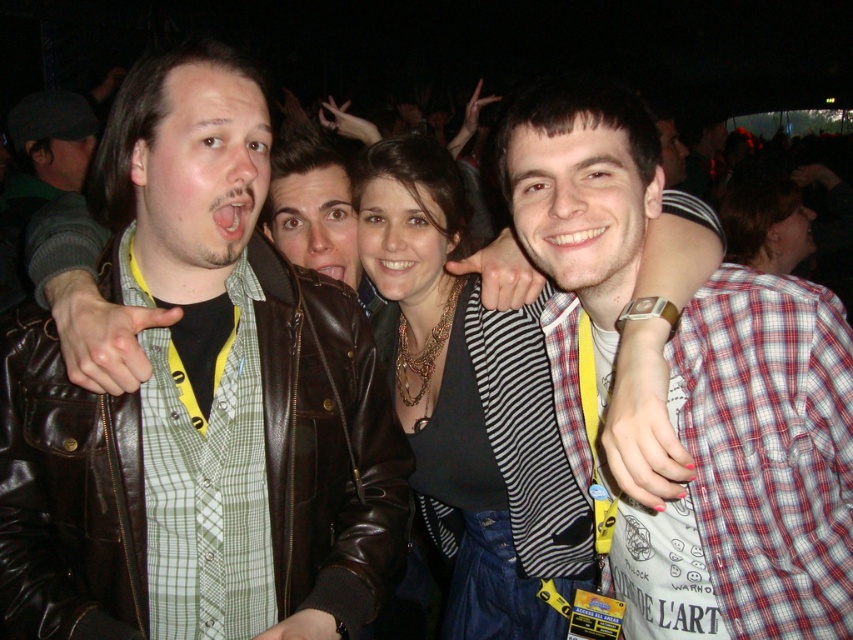
Where is `matte brown leather jacket at left`? matte brown leather jacket at left is located at coordinates [200, 404].

Who is more distant from viewer, (186, 109) or (534, 611)?

The point (534, 611) is behind.

Locate an element on the screen. This screenshot has width=853, height=640. matte brown leather jacket at left is located at coordinates (200, 404).